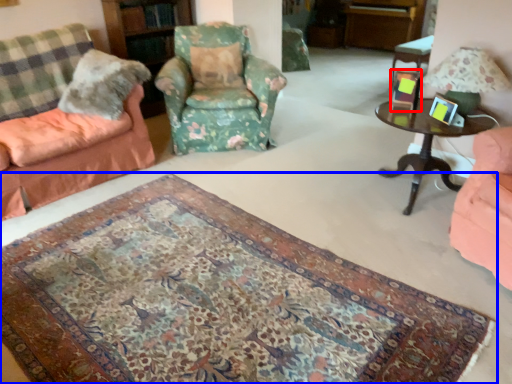
Question: Which object is further to the camera taking this photo, picture frame (highlighted by a red box) or mat (highlighted by a blue box)?

Choices:
 (A) picture frame
 (B) mat

Answer: (A)